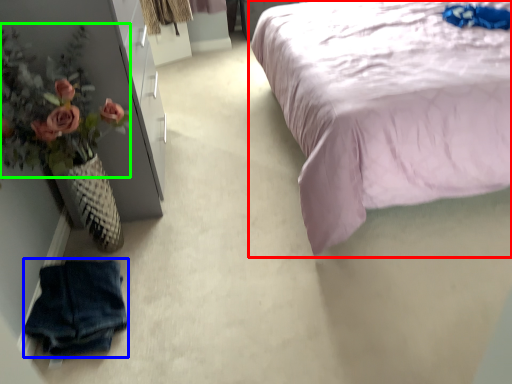
Question: Estimate the real-world distances between objects in this image. Which object is closer to bed (highlighted by a red box), clothing (highlighted by a blue box) or floral arrangement (highlighted by a green box)?

Choices:
 (A) clothing
 (B) floral arrangement

Answer: (B)